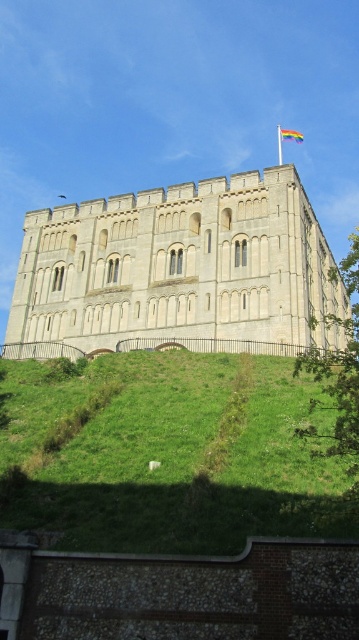
You are standing at the base of the green grassy hill at lower center and want to reach the beige stone castle at center. Which direction should you move to ascend towards the castle?

You should move towards the beige stone castle at center because it is higher than the green grassy hill at lower center, so ascending towards it would mean moving in its direction.

You are standing at the base of the green grassy hill at lower center and want to reach the green leafy tree at right. Which direction should you walk to get closer to the tree?

To reach the green leafy tree at right from the green grassy hill at lower center, you should walk towards the right since the tree is positioned to the right of the hill.